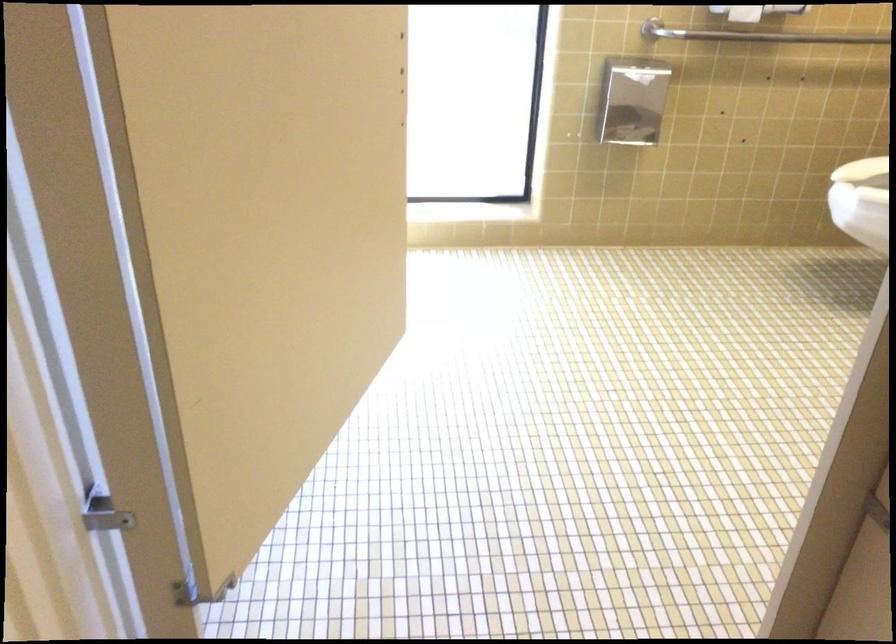
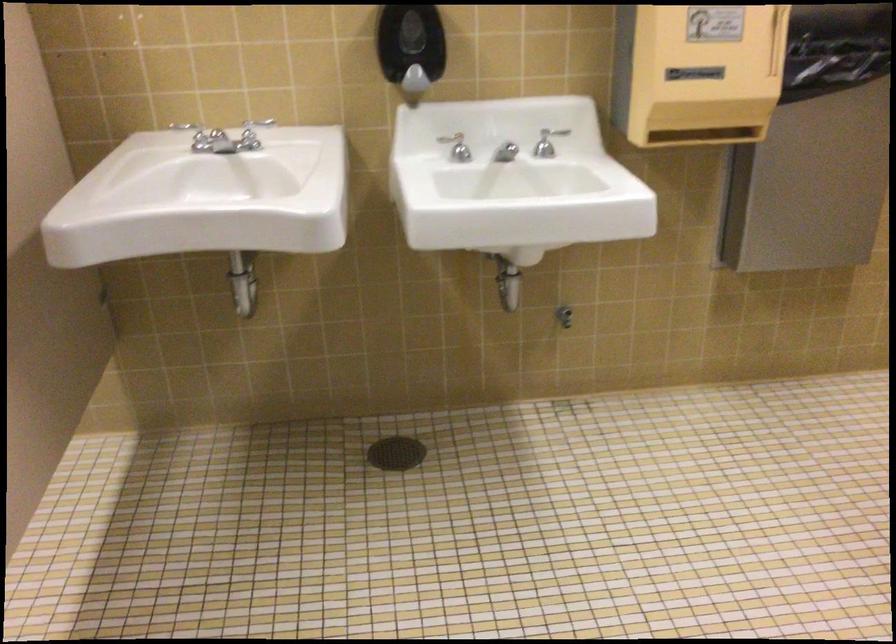
Based on the continuous images, in which direction is the camera rotating?

The camera rotated toward right-down.